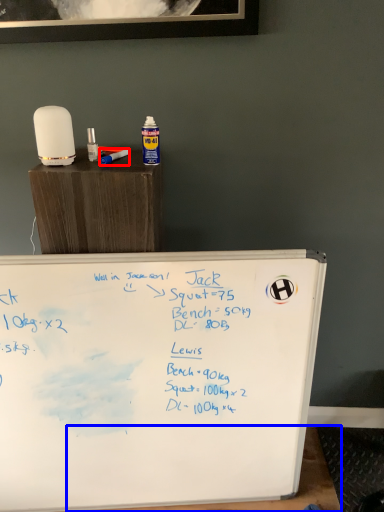
Question: Among these objects, which one is nearest to the camera, paint brush (highlighted by a red box) or table (highlighted by a blue box)?

Choices:
 (A) paint brush
 (B) table

Answer: (A)